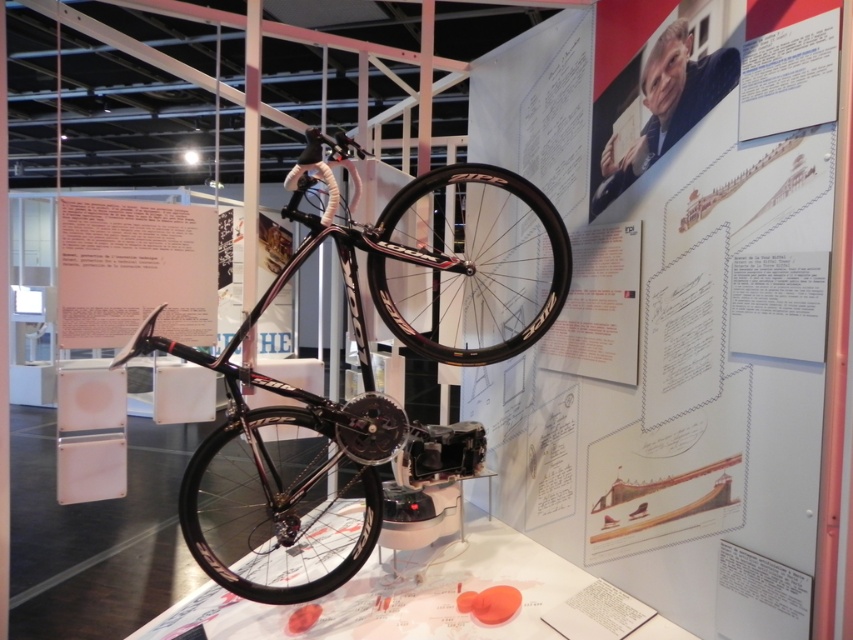
You are an art student who needs to measure the space between two objects in the image. You see the black glossy bicycle wheel at center and the white paper at center. Can you fit a 30 inch ruler between them without bending it?

The distance between the black glossy bicycle wheel at center and the white paper at center is 32.34 inches, so yes, a 30 inch ruler can fit between them without bending since it is shorter than the available space.

You are an art curator planning to move the shiny black bicycle at center and the black glossy bicycle wheel at center to a new exhibition space. The new space has a limited height of 1.8 meters. Can both items be moved without any adjustments?

The shiny black bicycle at center is positioned over the black glossy bicycle wheel at center, which means the total height would be the sum of both items. However, since the exact individual heights arenegative, it is impossible to determine if their combined height exceeds the 1.8 meter limit without additional information.